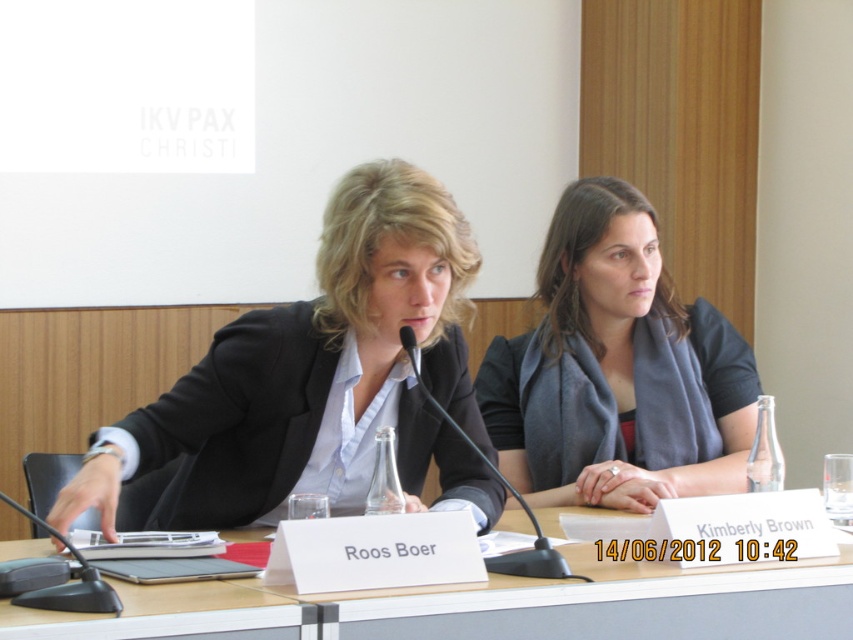
Can you confirm if matte gray scarf at center is smaller than transparent glass table at center?

Actually, matte gray scarf at center might be larger than transparent glass table at center.

Which is in front, point (550, 244) or point (73, 621)?

Positioned in front is point (73, 621).

Who is more forward, (492, 378) or (741, 586)?

Point (741, 586) is in front.

Locate an element on the screen. This screenshot has height=640, width=853. matte gray scarf at center is located at coordinates (618, 371).

Which is behind, point (708, 442) or point (527, 552)?

Point (708, 442)

Can you confirm if matte gray scarf at center is wider than black plastic microphone at center?

Yes, matte gray scarf at center is wider than black plastic microphone at center.

Who is more forward, (515, 452) or (404, 346)?

Point (404, 346)

You are a GUI agent. You are given a task and a screenshot of the screen. Output one action in this format:
    pyautogui.click(x=<x>, y=<y>)
    Task: Click on the matte gray scarf at center
    This screenshot has height=640, width=853.
    Given the screenshot: What is the action you would take?
    pyautogui.click(x=618, y=371)

Is the position of matte black blazer at center more distant than that of black plastic microphone at lower left?

Yes.

Can you confirm if matte black blazer at center is taller than black plastic microphone at lower left?

Correct, matte black blazer at center is much taller as black plastic microphone at lower left.

What do you see at coordinates (282, 428) in the screenshot?
I see `matte black blazer at center` at bounding box center [282, 428].

Where is `matte black blazer at center`? matte black blazer at center is located at coordinates (282, 428).